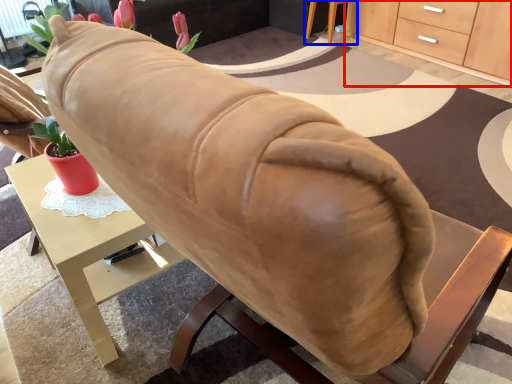
Question: Which object is closer to the camera taking this photo, cabinetry (highlighted by a red box) or table (highlighted by a blue box)?

Choices:
 (A) cabinetry
 (B) table

Answer: (A)